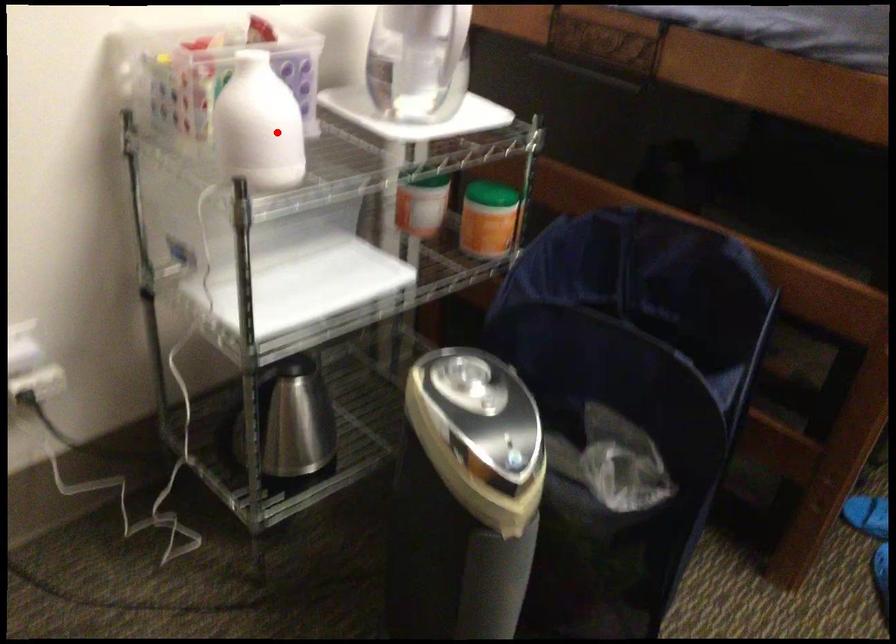
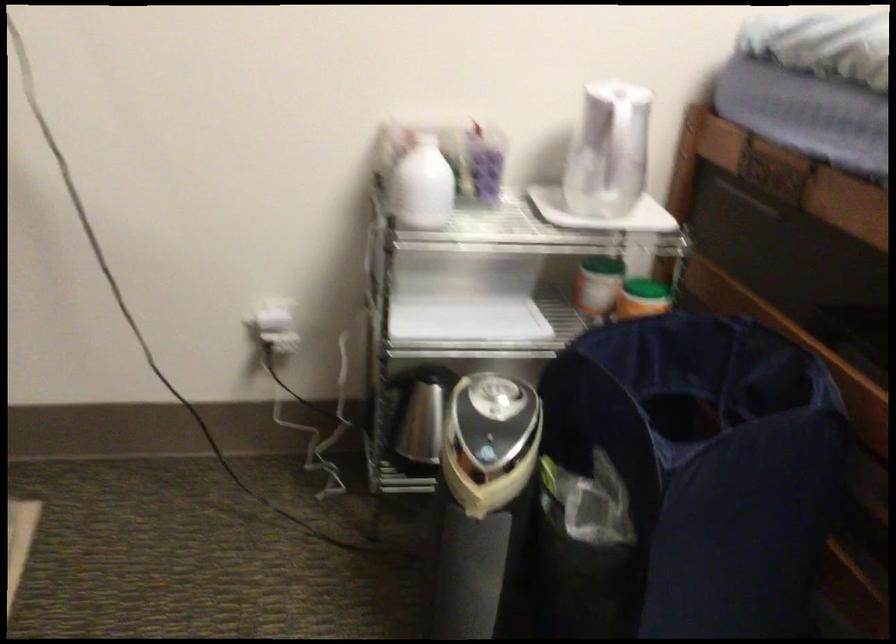
Question: A red point is marked in image1. In image2, is the corresponding 3D point closer to the camera or farther? Reply with the corresponding letter.

Choices:
 (A) The corresponding 3D point is closer.
 (B) The corresponding 3D point is farther.

Answer: (B)